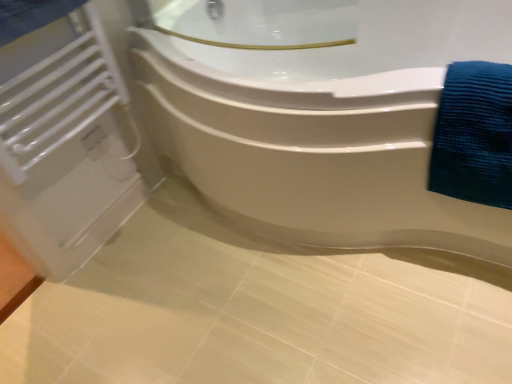
Question: From a real-world perspective, is white glossy bathtub at upper center physically located above or below white matte radiator at left?

Choices:
 (A) above
 (B) below

Answer: (B)

Question: Considering the positions of white glossy bathtub at upper center and white matte radiator at left in the image, is white glossy bathtub at upper center bigger or smaller than white matte radiator at left?

Choices:
 (A) big
 (B) small

Answer: (A)

Question: Which object is positioned farthest from the white glossy bathtub at upper center?

Choices:
 (A) blue textured towel at right
 (B) white matte radiator at left

Answer: (B)

Question: Estimate the real-world distances between objects in this image. Which object is closer to the blue textured towel at right?

Choices:
 (A) white matte radiator at left
 (B) white glossy bathtub at upper center

Answer: (B)